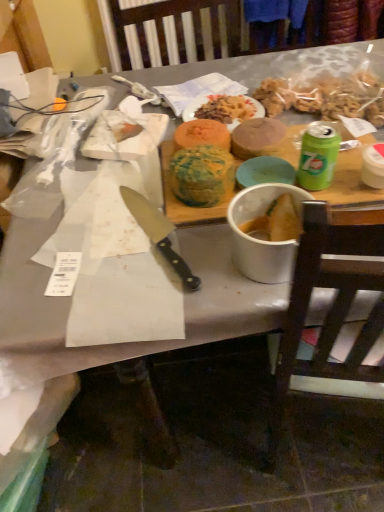
Where is `free space in front of green and yellow cake at center, placed as the 1th food when sorted from left to right`? This screenshot has width=384, height=512. free space in front of green and yellow cake at center, placed as the 1th food when sorted from left to right is located at coordinates (211, 243).